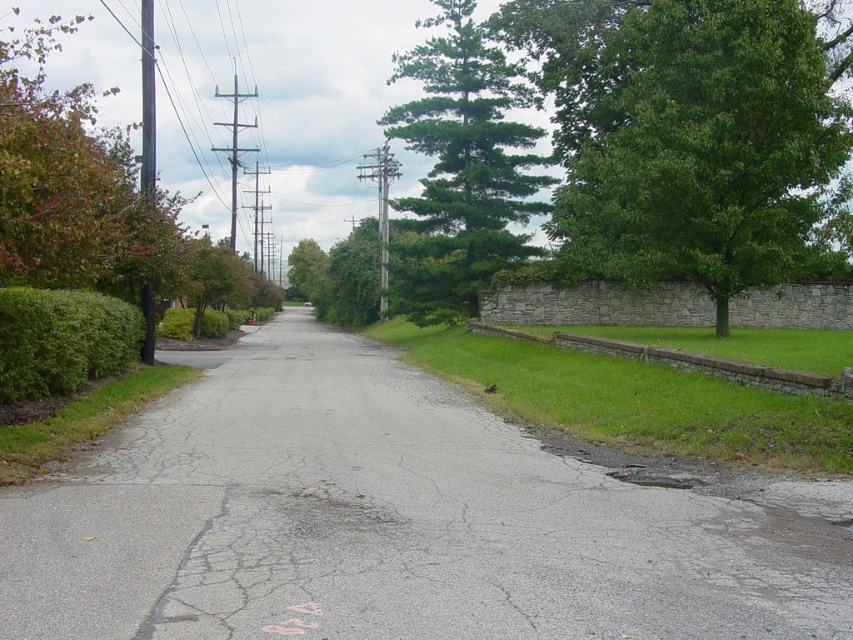
Question: Is the position of green leafy tree at left less distant than that of green leafy hedge at left?

Choices:
 (A) no
 (B) yes

Answer: (B)

Question: Which object is positioned farthest from the green leafy hedge at left?

Choices:
 (A) green leafy tree at left
 (B) green textured pine tree at upper center
 (C) gray asphalt driveway at center

Answer: (B)

Question: Which point is closer to the camera?

Choices:
 (A) green leafy tree at right
 (B) green textured pine tree at upper center
 (C) green leafy tree at center
 (D) gray asphalt driveway at center

Answer: (D)

Question: Which point is closer to the camera?

Choices:
 (A) green leafy tree at center
 (B) green leafy tree at right
 (C) green leafy hedge at left
 (D) green leafy tree at left

Answer: (D)

Question: From the image, what is the correct spatial relationship of green textured pine tree at upper center in relation to green leafy hedge at left?

Choices:
 (A) right
 (B) left

Answer: (A)

Question: In this image, where is green leafy tree at right located relative to green leafy tree at center?

Choices:
 (A) left
 (B) right

Answer: (B)